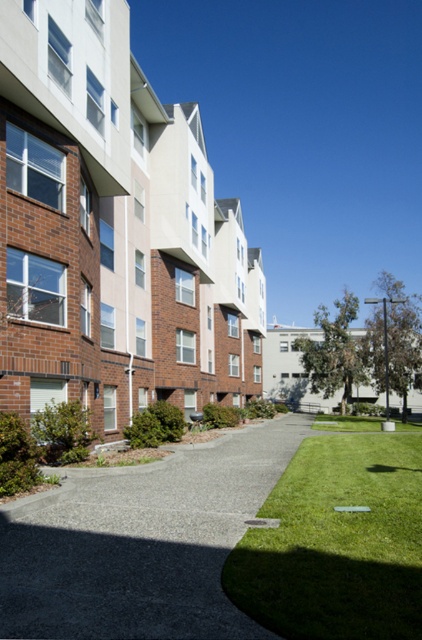
What do you see at coordinates (141, 541) in the screenshot? I see `gray concrete path at center` at bounding box center [141, 541].

How distant is gray concrete path at center from green grass at center?

gray concrete path at center is 1.71 meters from green grass at center.

Locate an element on the screen. The image size is (422, 640). gray concrete path at center is located at coordinates (141, 541).

I want to click on gray concrete path at center, so click(x=141, y=541).